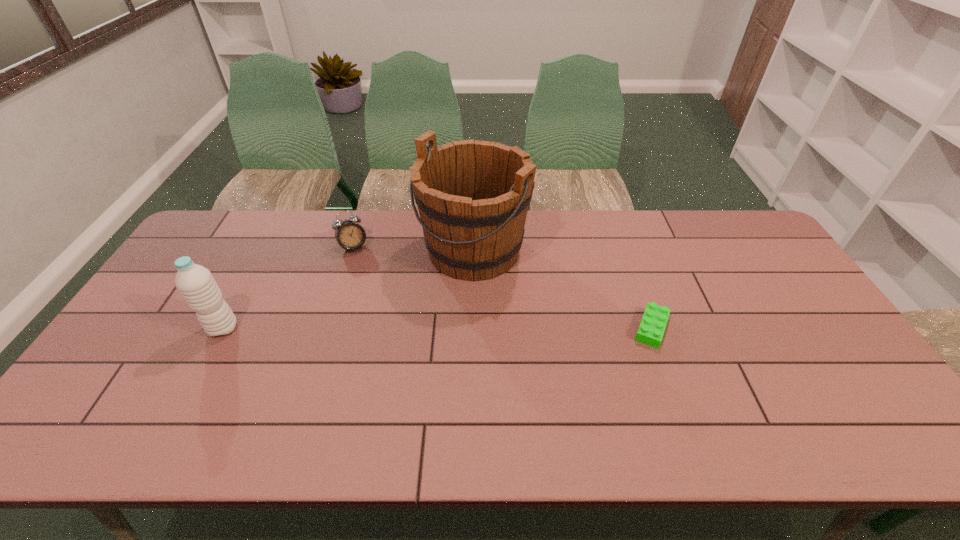
Image resolution: width=960 pixels, height=540 pixels. Find the location of `blank space at the left edge of the desktop`. blank space at the left edge of the desktop is located at coordinates (161, 320).

Locate an element on the screen. This screenshot has height=540, width=960. vacant region at the right edge of the desktop is located at coordinates (817, 323).

The image size is (960, 540). I want to click on vacant area at the far left corner, so click(254, 215).

You are a GUI agent. You are given a task and a screenshot of the screen. Output one action in this format:
    pyautogui.click(x=<x>, y=<y>)
    Task: Click on the vacant region at the near left corner of the desktop
    The width and height of the screenshot is (960, 540).
    Given the screenshot: What is the action you would take?
    pyautogui.click(x=132, y=402)

In the image, there is a desktop. Identify the location of vacant space at the near right corner. The image size is (960, 540). (831, 389).

This screenshot has height=540, width=960. What are the coordinates of `blank region between the rightmost object and the tallest object` in the screenshot? It's located at (562, 289).

At what (x,y) coordinates should I click in order to perform the action: click on vacant space that is in between the alarm clock and the rightmost object. Please return your answer as a coordinate pair (x, y). Looking at the image, I should click on (502, 288).

At what (x,y) coordinates should I click in order to perform the action: click on vacant space that's between the third object from right to left and the leftmost object. Please return your answer as a coordinate pair (x, y). Looking at the image, I should click on [x=288, y=288].

This screenshot has width=960, height=540. I want to click on vacant point located between the second object from right to left and the third shortest object, so click(348, 289).

At what (x,y) coordinates should I click in order to perform the action: click on vacant space in between the leftmost object and the rightmost object. Please return your answer as a coordinate pair (x, y). This screenshot has width=960, height=540. Looking at the image, I should click on (437, 328).